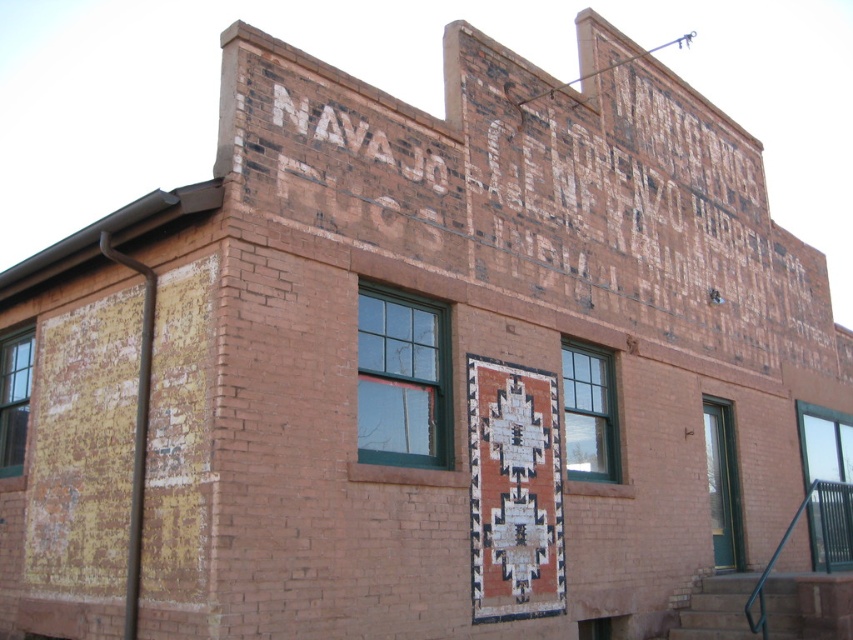
Between clear glass door at lower right and green glass window at center, which one is positioned lower?

clear glass door at lower right is below.

Is clear glass door at lower right shorter than green glass window at center?

Yes, clear glass door at lower right is shorter than green glass window at center.

Locate an element on the screen. This screenshot has height=640, width=853. clear glass door at lower right is located at coordinates pyautogui.click(x=827, y=483).

Can you confirm if green wood window at center is wider than clear glass door at lower right?

No.

I want to click on green wood window at center, so click(x=402, y=380).

Is point (367, 358) more distant than point (804, 440)?

No.

Locate an element on the screen. Image resolution: width=853 pixels, height=640 pixels. green wood window at center is located at coordinates (402, 380).

Is clear glass door at lower right thinner than clear glass window at lower left?

No, clear glass door at lower right is not thinner than clear glass window at lower left.

Looking at this image, how much distance is there between clear glass door at lower right and clear glass window at lower left?

They are 47.03 feet apart.

Which is behind, point (808, 476) or point (25, 365)?

The point (808, 476) is more distant.

Find the location of a particular element. clear glass door at lower right is located at coordinates (827, 483).